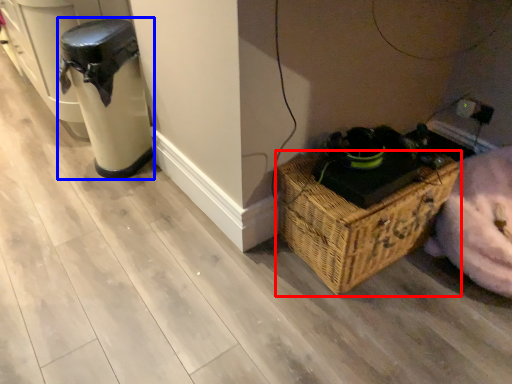
Question: Among these objects, which one is farthest to the camera, picnic basket (highlighted by a red box) or appliance (highlighted by a blue box)?

Choices:
 (A) picnic basket
 (B) appliance

Answer: (B)